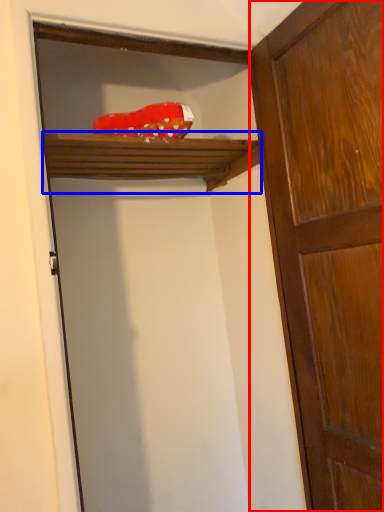
Question: Which point is further to the camera, door (highlighted by a red box) or shelf (highlighted by a blue box)?

Choices:
 (A) door
 (B) shelf

Answer: (B)